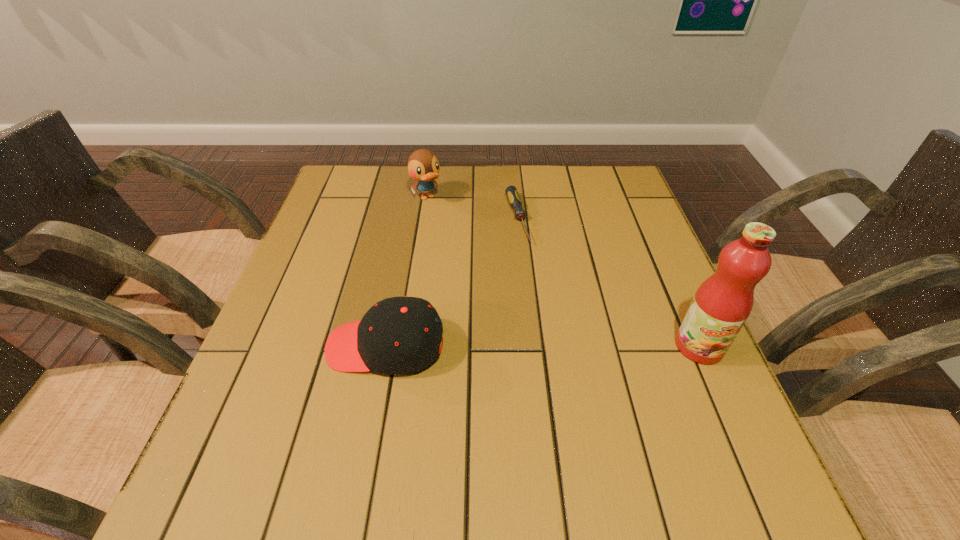
Identify the location of vacant space at the left edge of the desktop. This screenshot has height=540, width=960. (333, 261).

This screenshot has width=960, height=540. I want to click on blank area at the right edge, so click(x=650, y=284).

Image resolution: width=960 pixels, height=540 pixels. In order to click on free region at the far right corner in this screenshot , I will do `click(596, 189)`.

Image resolution: width=960 pixels, height=540 pixels. I want to click on vacant space that is in between the tallest object and the third shortest object, so click(x=563, y=272).

Find the location of a particular element. Image resolution: width=960 pixels, height=540 pixels. free space between the tallest object and the third tallest object is located at coordinates (542, 346).

The width and height of the screenshot is (960, 540). I want to click on free space between the tallest object and the cap, so click(x=542, y=346).

Image resolution: width=960 pixels, height=540 pixels. In order to click on free space between the third tallest object and the third object from left to right in this screenshot , I will do pos(451,282).

Identify the location of free point between the second tallest object and the screwdriver. (471, 208).

Where is `vacant point located between the rightmost object and the second shortest object`? The image size is (960, 540). vacant point located between the rightmost object and the second shortest object is located at coordinates (542, 346).

Where is `free area in between the cap and the duck`? Image resolution: width=960 pixels, height=540 pixels. free area in between the cap and the duck is located at coordinates (406, 272).